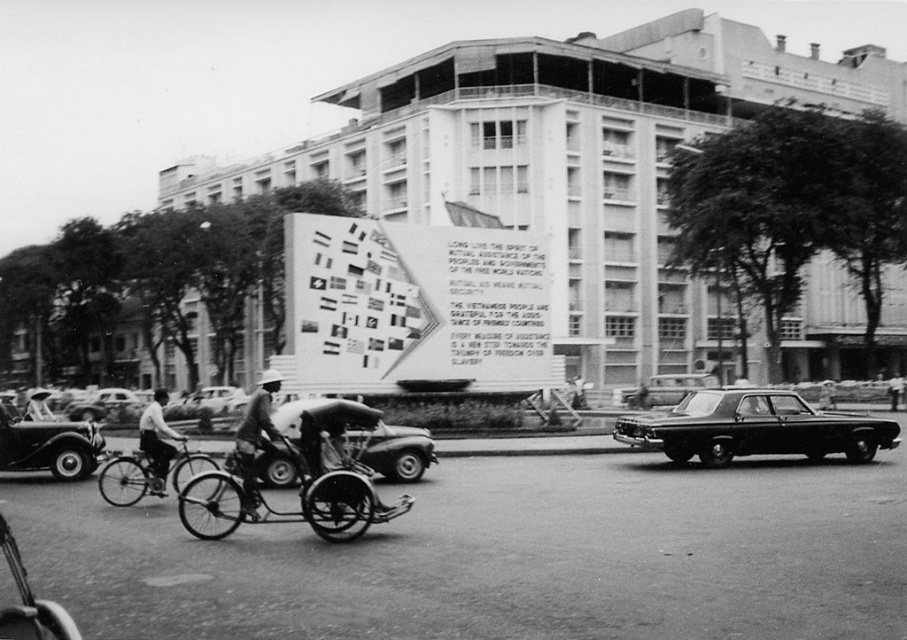
Between shiny silver bicycle at center-left and dark gray fabric hat at center, which one appears on the right side from the viewer's perspective?

Positioned to the right is shiny silver bicycle at center-left.

Measure the distance between shiny silver bicycle at center-left and camera.

They are 46.07 feet apart.

Does point (129, 468) come closer to viewer compared to point (270, 448)?

No, (129, 468) is behind (270, 448).

Locate an element on the screen. This screenshot has width=907, height=640. shiny silver bicycle at center-left is located at coordinates (147, 474).

Does metallic silver tricycle at center appear on the left side of metallic silver car at center?

In fact, metallic silver tricycle at center is to the right of metallic silver car at center.

Is metallic silver tricycle at center wider than metallic silver car at center?

No, metallic silver tricycle at center is not wider than metallic silver car at center.

Is point (249, 452) closer to camera compared to point (408, 451)?

That is True.

The height and width of the screenshot is (640, 907). I want to click on metallic silver tricycle at center, so click(x=303, y=477).

Who is lower down, metallic silver car at center or shiny black sedan at center?

Positioned lower is shiny black sedan at center.

Does metallic silver car at center come behind shiny black sedan at center?

No, metallic silver car at center is closer to the viewer.

Between point (424, 449) and point (621, 397), which one is positioned behind?

Point (621, 397)

Identify the location of metallic silver car at center. The height and width of the screenshot is (640, 907). (398, 451).